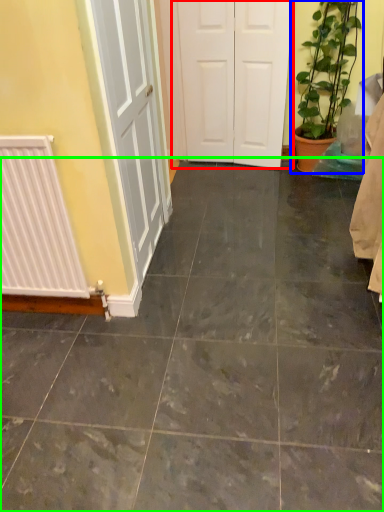
Question: Which object is the closest to the door (highlighted by a red box)? Choose among these: houseplant (highlighted by a blue box) or ceramic tile (highlighted by a green box).

Choices:
 (A) houseplant
 (B) ceramic tile

Answer: (A)